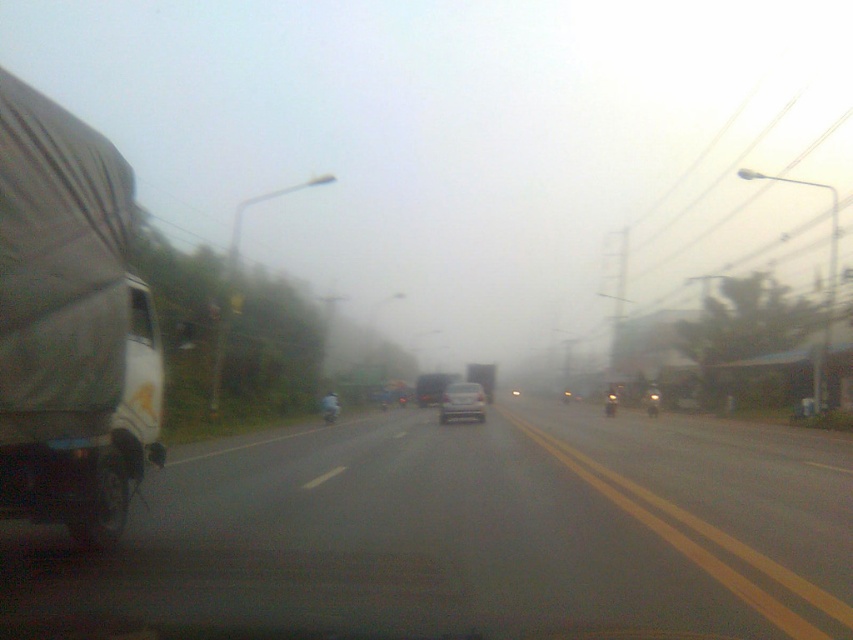
Between point (393, 452) and point (28, 268), which one is positioned in front?

Point (28, 268) is in front.

Does point (572, 536) come closer to viewer compared to point (6, 340)?

That is False.

Identify the location of black matte truck at left. (476, 532).

Is white matte trailer truck at left to the left of silver metallic sedan at center from the viewer's perspective?

Yes, white matte trailer truck at left is to the left of silver metallic sedan at center.

Who is more distant from viewer, (96, 221) or (485, 416)?

Point (485, 416)

Image resolution: width=853 pixels, height=640 pixels. What are the coordinates of `white matte trailer truck at left` in the screenshot? It's located at (70, 324).

Is black matte truck at left smaller than silver metallic sedan at center?

Incorrect, black matte truck at left is not smaller in size than silver metallic sedan at center.

Is black matte truck at left below silver metallic sedan at center?

Yes.

Where is `black matte truck at left`? The image size is (853, 640). black matte truck at left is located at coordinates (476, 532).